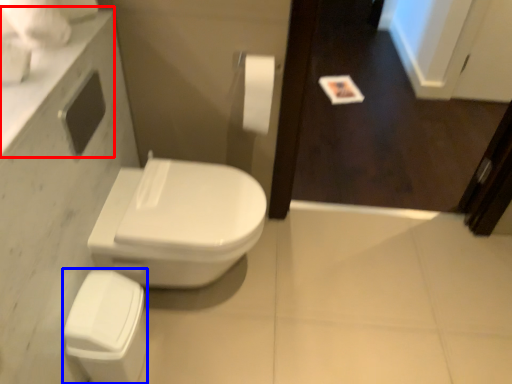
Question: Among these objects, which one is farthest to the camera, counter top (highlighted by a red box) or porcelain (highlighted by a blue box)?

Choices:
 (A) counter top
 (B) porcelain

Answer: (B)